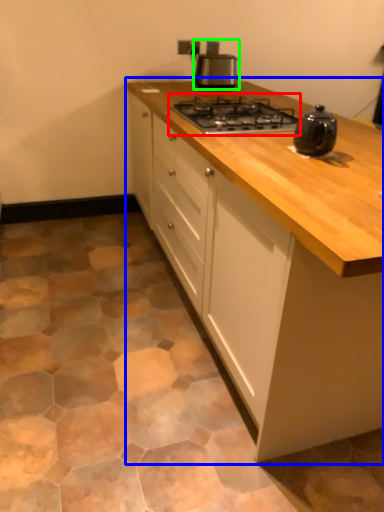
Question: Estimate the real-world distances between objects in this image. Which object is farther from gas stove (highlighted by a red box), cabinetry (highlighted by a blue box) or kitchen appliance (highlighted by a green box)?

Choices:
 (A) cabinetry
 (B) kitchen appliance

Answer: (B)